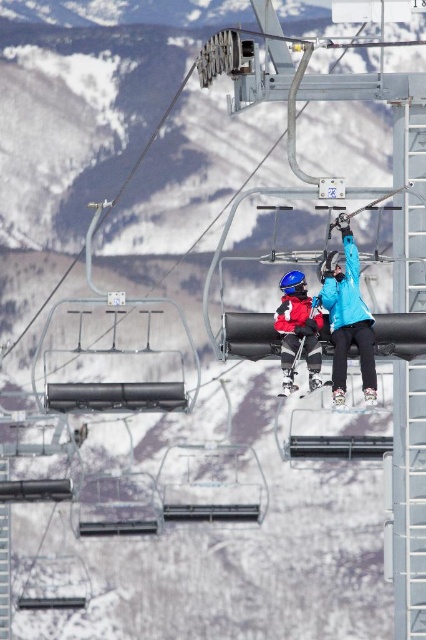
You are a photographer at the ski resort and want to take a photo of both the blue matte jacket at upper center and the matte red ski suit at center. Since you can only focus on one subject at a time, which one should you focus on first to ensure both are in the frame?

You should focus on the matte red ski suit at center first because the blue matte jacket at upper center is to the right of it, so positioning the focus on the center subject allows the right subject to remain within the frame.

You are standing at the base of the ski resort and looking up at the ski lift. There are two points marked on the ski lift cables. The first point is at coordinates point (357, 275) and the second point is at point (304, 292). Which point is closer to you?

Point (357, 275) is in front of point (304, 292), so it is closer to you.